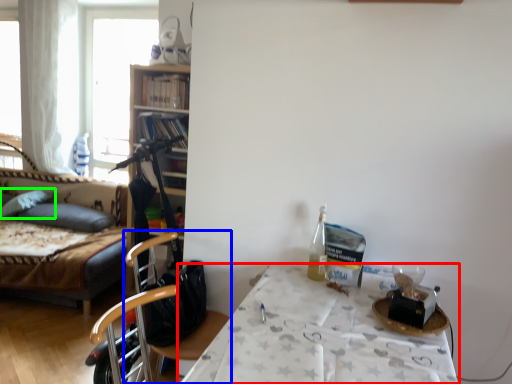
Question: Which object is the closest to the table (highlighted by a red box)? Choose among these: chair (highlighted by a blue box) or pillow (highlighted by a green box).

Choices:
 (A) chair
 (B) pillow

Answer: (A)